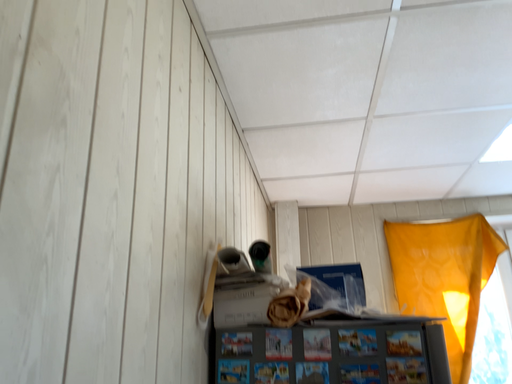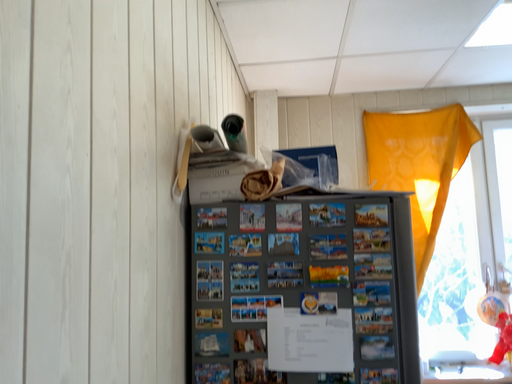
Question: Which way did the camera rotate in the video?

Choices:
 (A) rotated upward
 (B) rotated downward

Answer: (B)